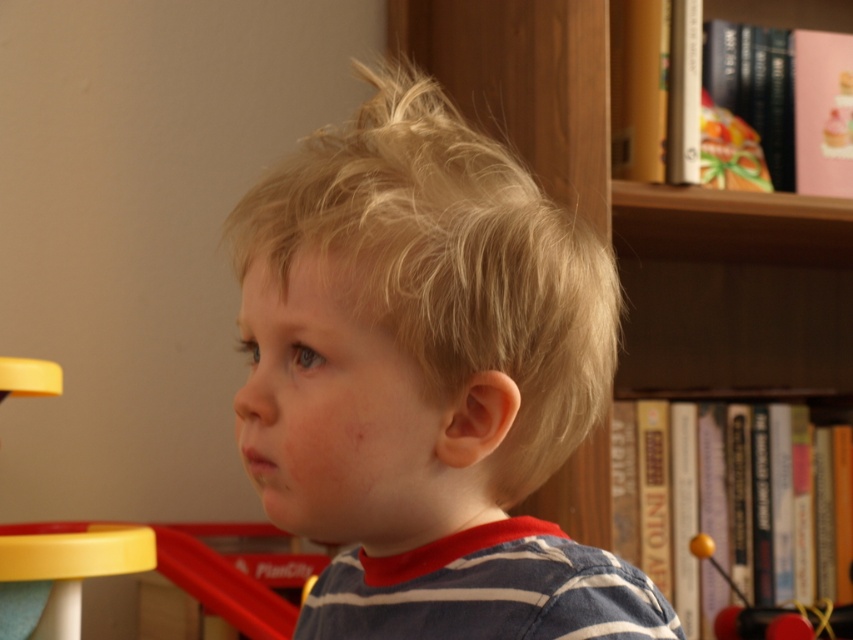
Question: Which of the following is the farthest from the observer?

Choices:
 (A) wooden bookshelf at upper right
 (B) blonde hair at center
 (C) yellow rubber ball at right

Answer: (C)

Question: Which point appears farthest from the camera in this image?

Choices:
 (A) (850, 250)
 (B) (753, 620)

Answer: (A)

Question: Does wooden bookshelf at upper right have a smaller size compared to yellow rubber ball at right?

Choices:
 (A) yes
 (B) no

Answer: (B)

Question: Does blonde hair at center have a smaller size compared to wooden bookshelf at upper right?

Choices:
 (A) no
 (B) yes

Answer: (B)

Question: Based on their relative distances, which object is nearer to the yellow rubber ball at right?

Choices:
 (A) wooden bookshelf at upper right
 (B) blonde hair at center

Answer: (A)

Question: Does blonde hair at center have a lesser width compared to yellow rubber ball at right?

Choices:
 (A) yes
 (B) no

Answer: (B)